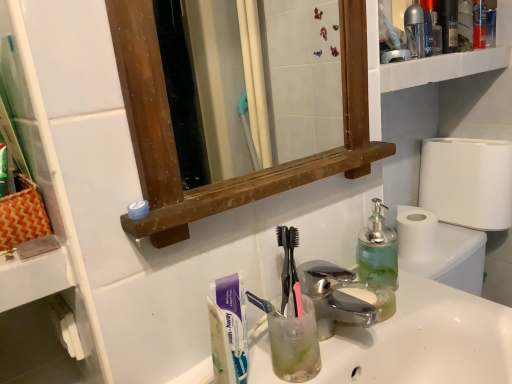
Locate an element on the screen. The height and width of the screenshot is (384, 512). free point above white glossy sink at center (from a real-world perspective) is located at coordinates (356, 330).